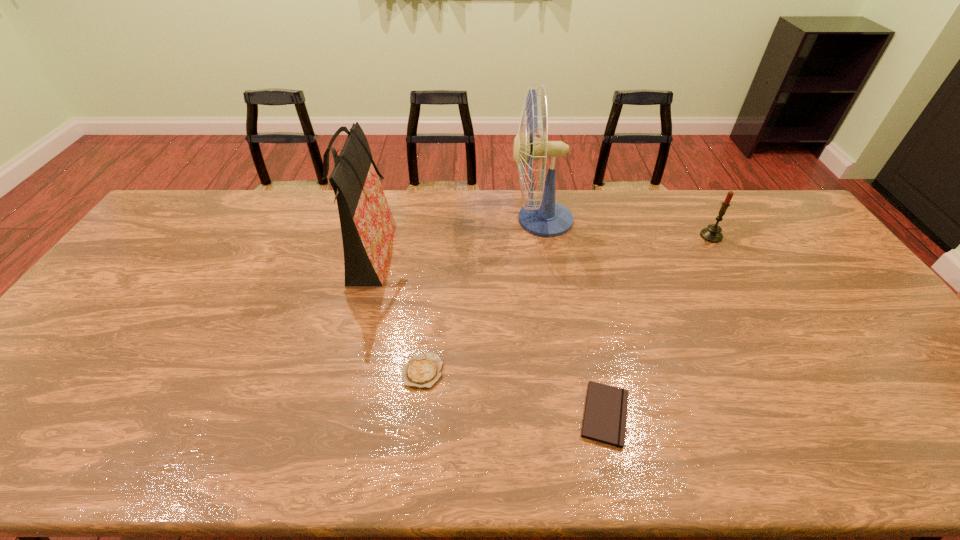
Locate an element on the screen. fan is located at coordinates (545, 218).

Identify the location of shopping bag. Image resolution: width=960 pixels, height=540 pixels. (367, 225).

I want to click on the third tallest object, so click(x=712, y=233).

Where is `the rightmost object`? The width and height of the screenshot is (960, 540). the rightmost object is located at coordinates (712, 233).

This screenshot has height=540, width=960. In order to click on the fourth object from right to left in this screenshot , I will do `click(422, 371)`.

Locate an element on the screen. This screenshot has width=960, height=540. checkbook is located at coordinates (605, 415).

You are a GUI agent. You are given a task and a screenshot of the screen. Output one action in this format:
    pyautogui.click(x=<x>, y=<y>)
    Task: Click on the free spot located at the front of the fan where the blades are visible
    
    Given the screenshot: What is the action you would take?
    pyautogui.click(x=435, y=220)

At what (x,y) coordinates should I click in order to perform the action: click on vacant space located 0.230m at the front of the fan where the blades are visible. Please return your answer as a coordinate pair (x, y). The image size is (960, 540). Looking at the image, I should click on (444, 220).

Locate an element on the screen. free space located 0.230m at the front of the fan where the blades are visible is located at coordinates (444, 220).

Where is `free space located 0.280m on the front side of the shopping bag`? free space located 0.280m on the front side of the shopping bag is located at coordinates (484, 257).